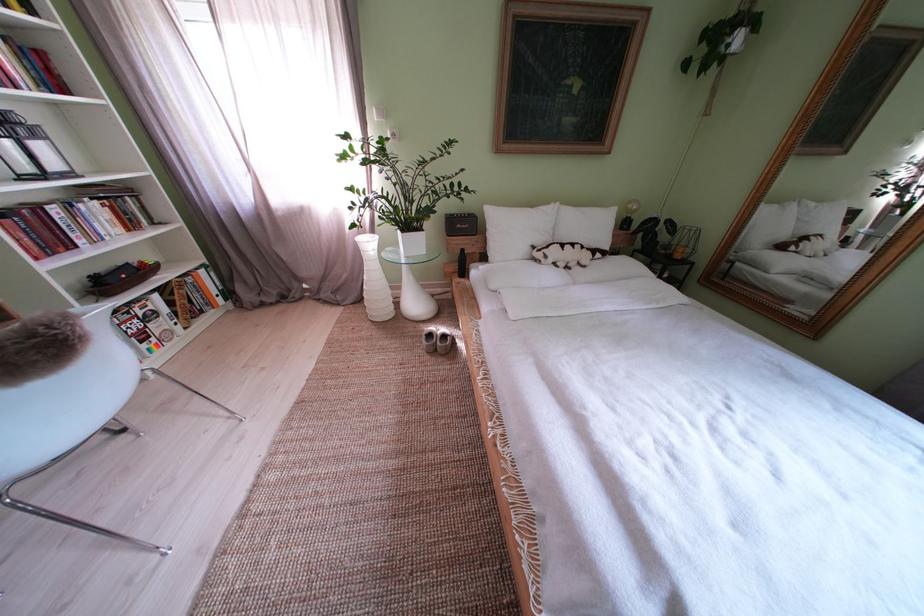
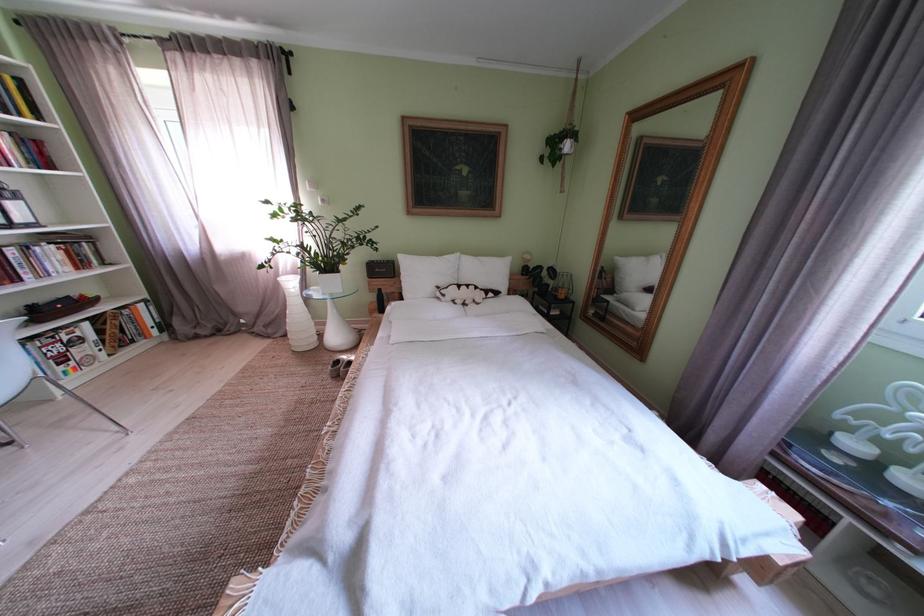
Where in the second image is the point corresponding to the point at 152,268 from the first image?

(92, 302)